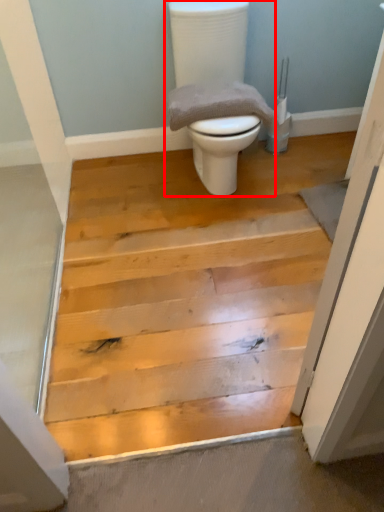
Question: Observing the image, what is the correct spatial positioning of toilet (annotated by the red box) in reference to material?

Choices:
 (A) left
 (B) right

Answer: (B)